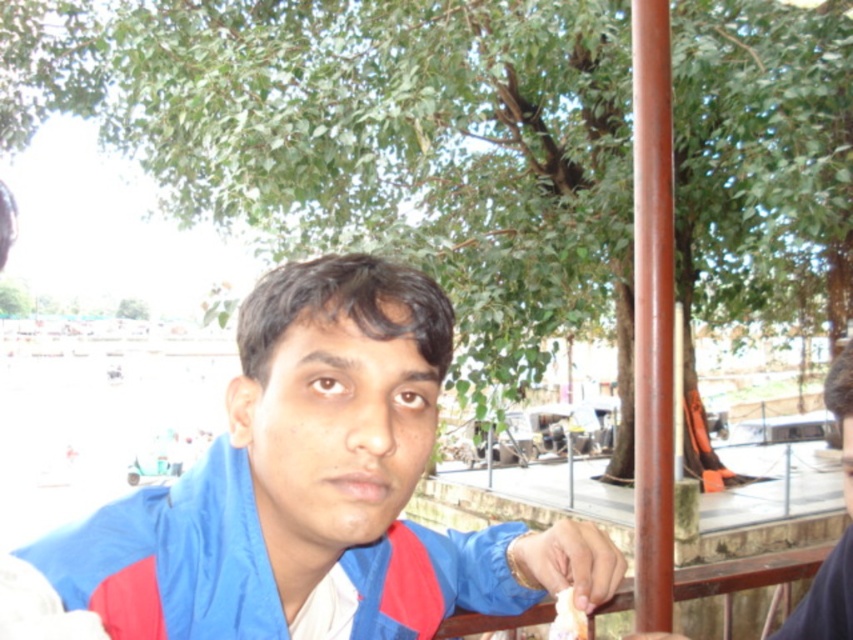
You are a personal assistant standing next to the blue fabric jacket at center. Your task is to hand a document to someone who is 1.6 meters tall. Can you reach the person without moving the jacket?

The blue fabric jacket at center and viewer are 71.45 centimeters apart from each other. Since the person is 1.6 meters tall, the assistant can reach them as the distance is within a comfortable arm reach.

Where is the blue fabric jacket at center located in the image?

The blue fabric jacket at center is located at point (x=308, y=492).

You are a food delivery person who needs to deliver a meal to the person sitting on the bench. The meal contains the white creamy food at lower center. To ensure the food stays warm, you must place it below the blue fabric jacket at center. Is this possible based on the scene?

The blue fabric jacket at center is above the white creamy food at lower center, so placing the white creamy food at lower center below the jacket would be possible as it is already positioned that way in the scene.